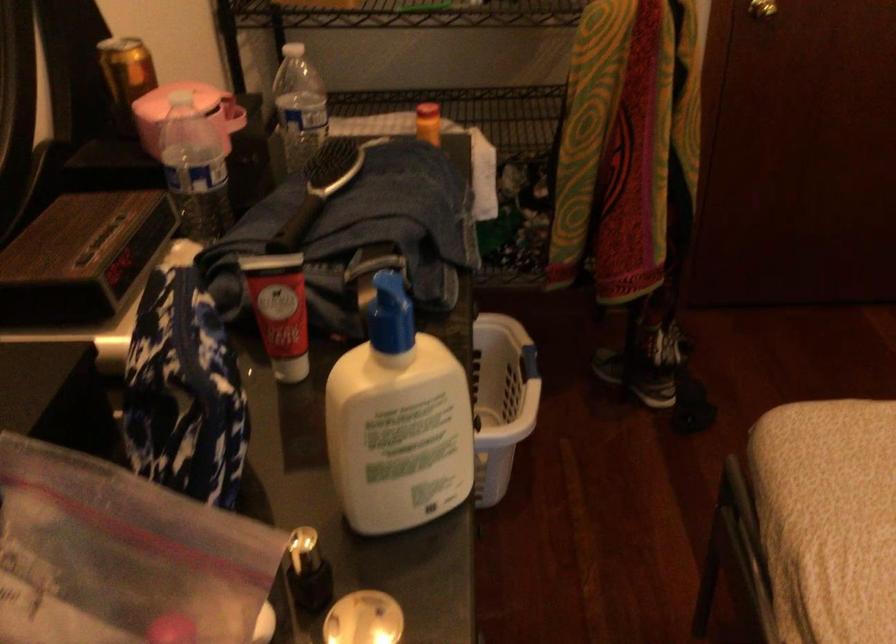
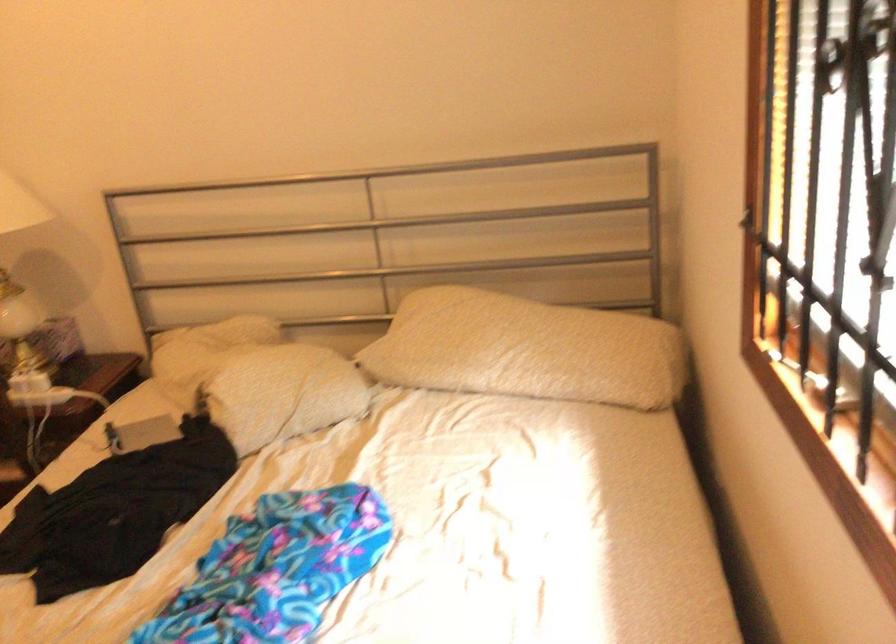
Question: Based on the continuous images, in which direction is the camera rotating? Reply with the corresponding letter.

Choices:
 (A) Left
 (B) Right
 (C) Up
 (D) Down

Answer: (B)